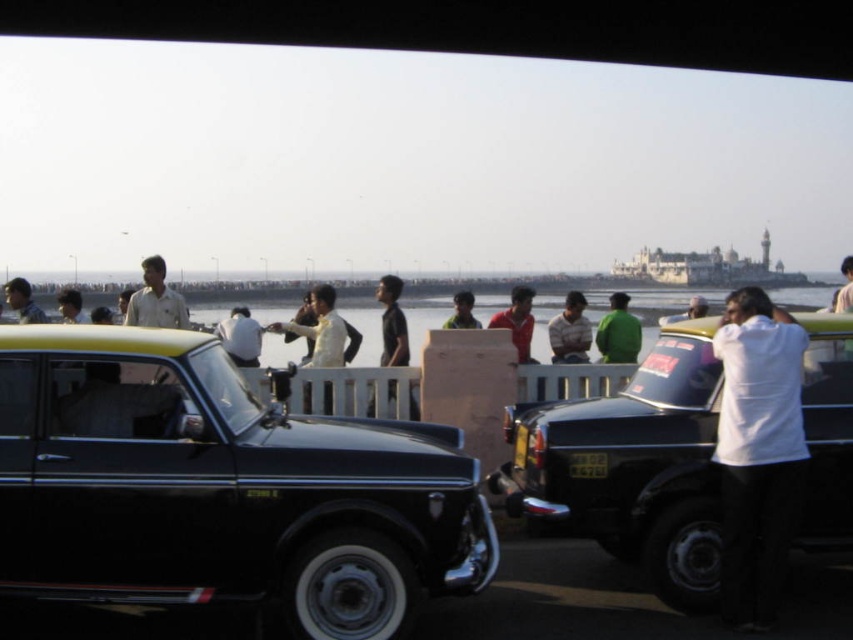
Question: Is the position of shiny black car at center more distant than that of black glossy taxi at center?

Choices:
 (A) no
 (B) yes

Answer: (A)

Question: Can you confirm if black matte shirt at center is thinner than matte red shirt at center?

Choices:
 (A) no
 (B) yes

Answer: (B)

Question: Which of the following is the farthest from the observer?

Choices:
 (A) (367, 410)
 (B) (801, 468)
 (C) (85, 314)

Answer: (C)

Question: Which object is positioned closest to the matte beige shirt at center?

Choices:
 (A) matte red shirt at center
 (B) light brown fabric shirt at center

Answer: (A)

Question: Which of the following is the closest to the observer?

Choices:
 (A) matte red shirt at center
 (B) light brown fabric shirt at center
 (C) shiny black car at center
 (D) black glossy taxi at center

Answer: (C)

Question: Does light brown fabric shirt at center lie in front of matte red shirt at center?

Choices:
 (A) no
 (B) yes

Answer: (A)